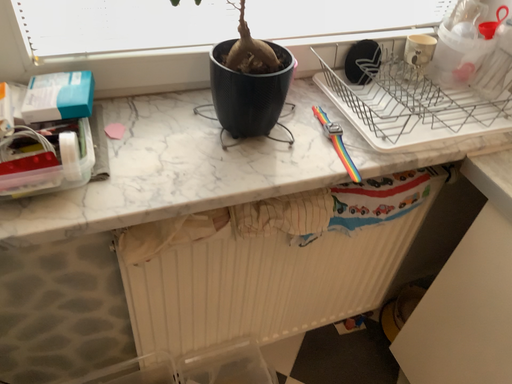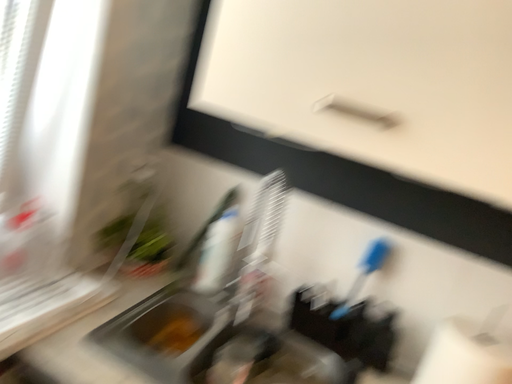
Question: How did the camera likely rotate when shooting the video?

Choices:
 (A) rotated right
 (B) rotated left

Answer: (A)